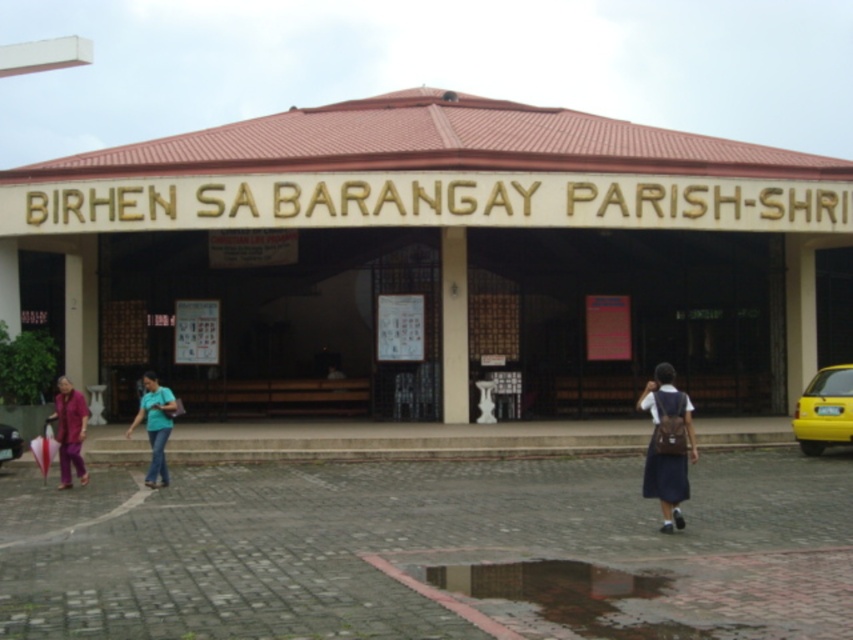
You are standing in front of the BIRHEN SA BARANGAY PARISH building and want to take a photo. You notice two points marked as point 1 at coordinates (73, 406) and point 2 at coordinates (167, 397). Which point will appear larger in your photo?

Point 1 at coordinates (73, 406) will appear larger in the photo because it is closer to the camera than point 2 at coordinates (167, 397).